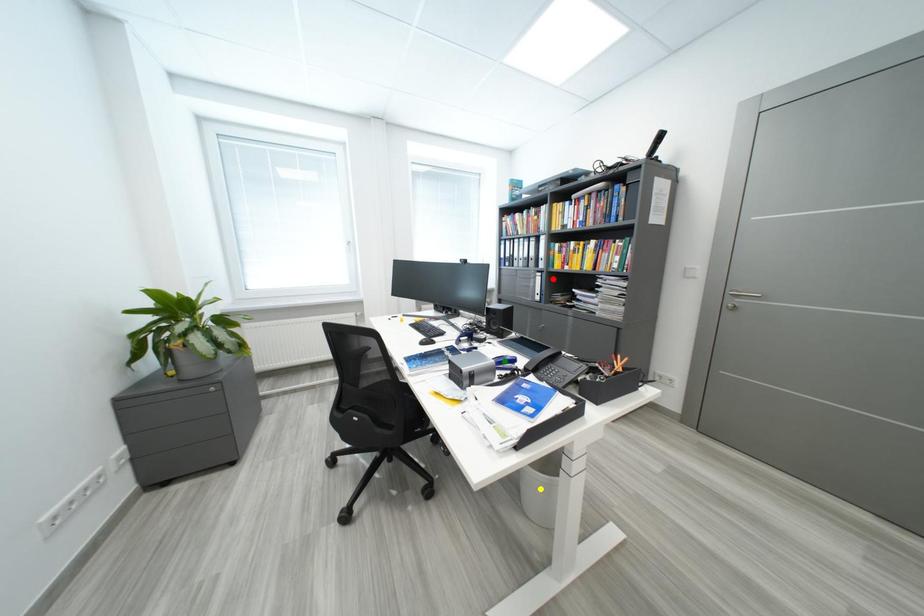
Order these from nearest to farthest:
green point, yellow point, red point

yellow point < green point < red point